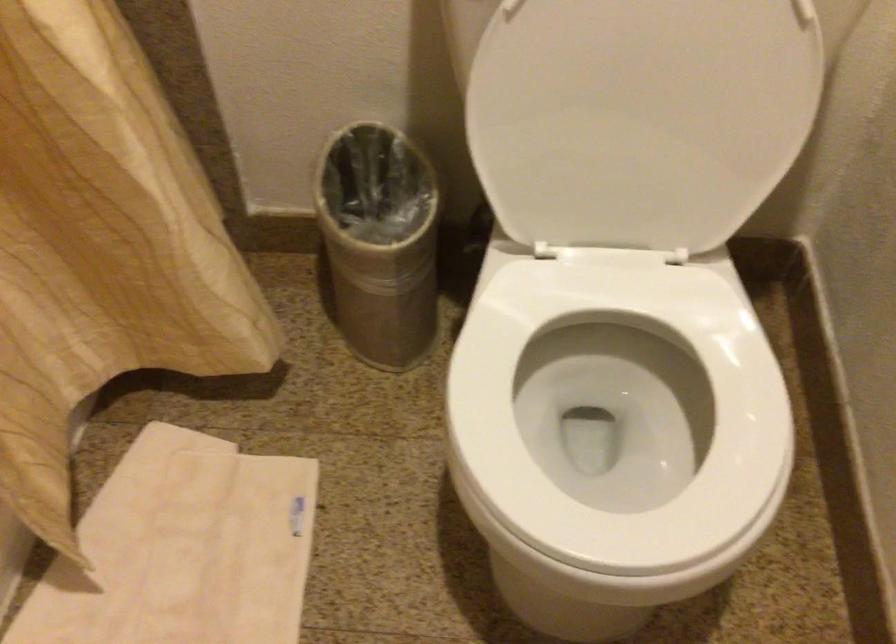
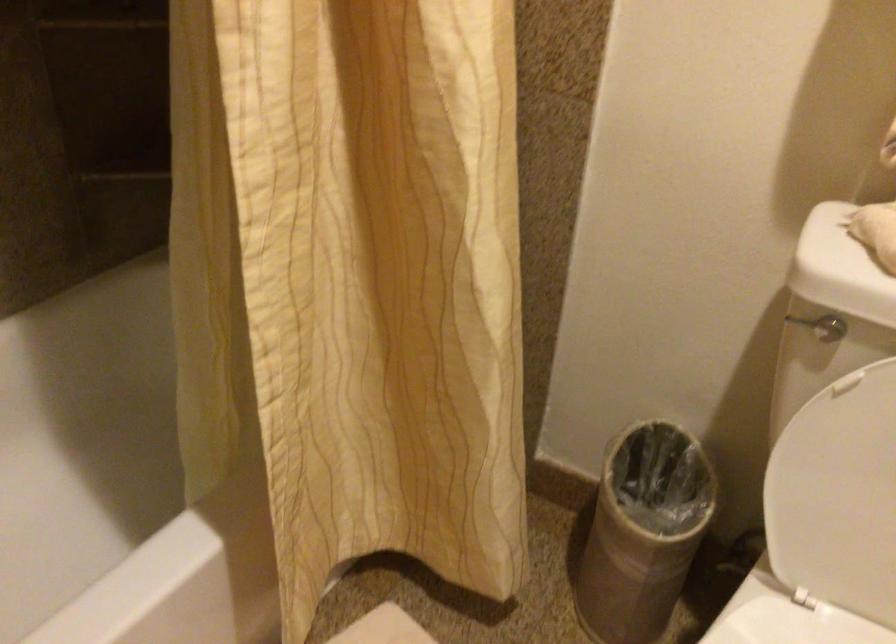
Find the pixel in the second image that matches the point at 538,117 in the first image.

(834, 480)